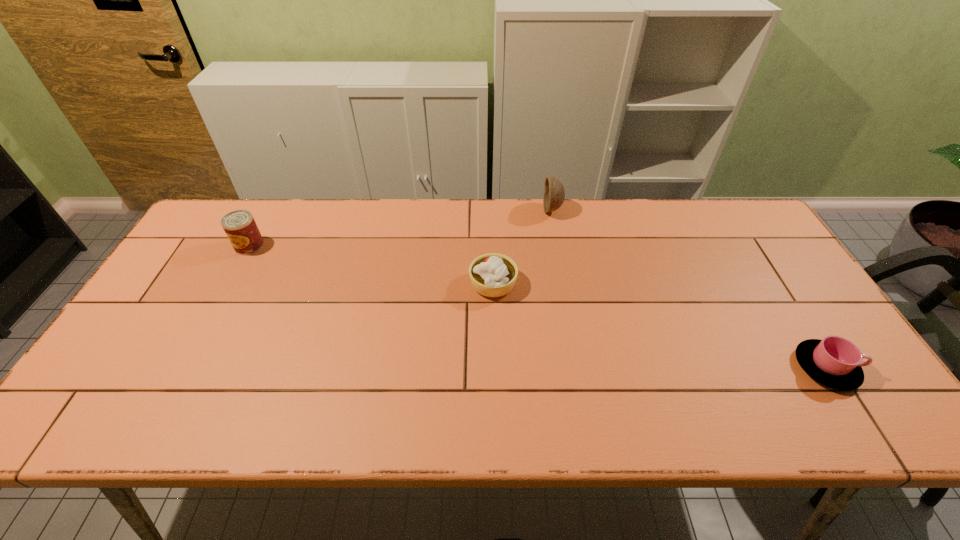
Where is `the farthest object`? the farthest object is located at coordinates (554, 193).

This screenshot has width=960, height=540. I want to click on bowl, so click(x=554, y=193).

Where is `can`? can is located at coordinates (240, 227).

At what (x,y) coordinates should I click in order to perform the action: click on the leftmost object. Please return your answer as a coordinate pair (x, y). The image size is (960, 540). Looking at the image, I should click on (240, 227).

You are a GUI agent. You are given a task and a screenshot of the screen. Output one action in this format:
    pyautogui.click(x=<x>, y=<y>)
    Task: Click on the whipped cream
    
    Given the screenshot: What is the action you would take?
    [x=492, y=275]

Locate an element on the screen. the third farthest object is located at coordinates pos(492,275).

Find the location of `the rightmost object`. the rightmost object is located at coordinates (835, 362).

Find the location of a particular element. The height and width of the screenshot is (540, 960). cup is located at coordinates (835, 362).

Where is `free space located 0.050m on the right of the second object from right to left`? This screenshot has width=960, height=540. free space located 0.050m on the right of the second object from right to left is located at coordinates (576, 210).

Locate an element on the screen. The image size is (960, 540). free location located on the front of the can is located at coordinates (227, 287).